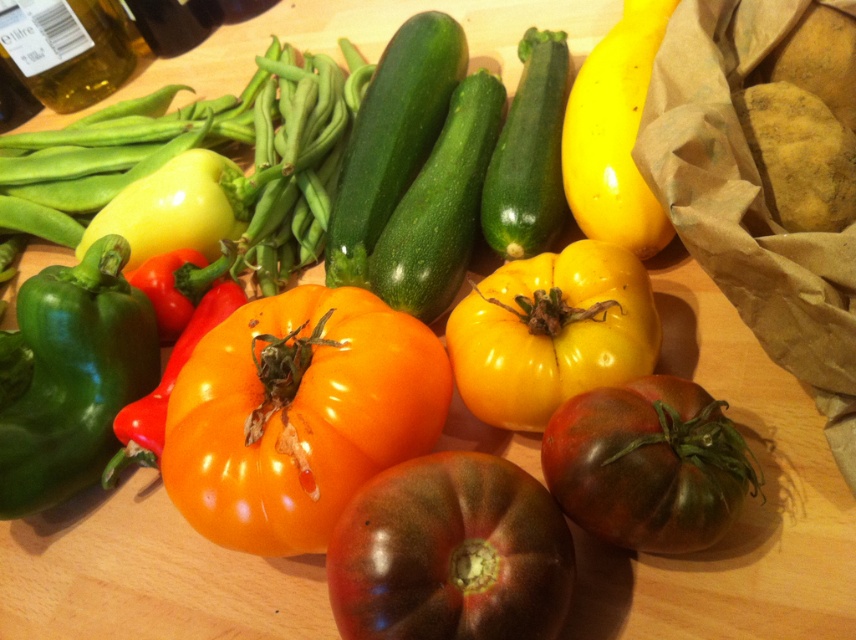
Question: Is dark red matte tomato at center behind yellow matte tomato at center?

Choices:
 (A) no
 (B) yes

Answer: (A)

Question: Which of the following is the closest to the observer?

Choices:
 (A) (489, 387)
 (B) (592, 468)
 (C) (46, 346)

Answer: (B)

Question: Where is dark green matte tomato at center located in relation to yellow smooth pepper at upper right in the image?

Choices:
 (A) left
 (B) right

Answer: (A)

Question: Can you confirm if shiny orange tomato at center is positioned to the right of dark red matte tomato at center?

Choices:
 (A) no
 (B) yes

Answer: (A)

Question: Which object is the farthest from the yellow matte tomato at center?

Choices:
 (A) dark green matte tomato at center
 (B) shiny orange tomato at center
 (C) yellow smooth pepper at upper right

Answer: (C)

Question: Which of these objects is positioned farthest from the green glossy bell pepper at left?

Choices:
 (A) shiny orange tomato at center
 (B) dark red matte tomato at center
 (C) dark green matte tomato at center

Answer: (C)